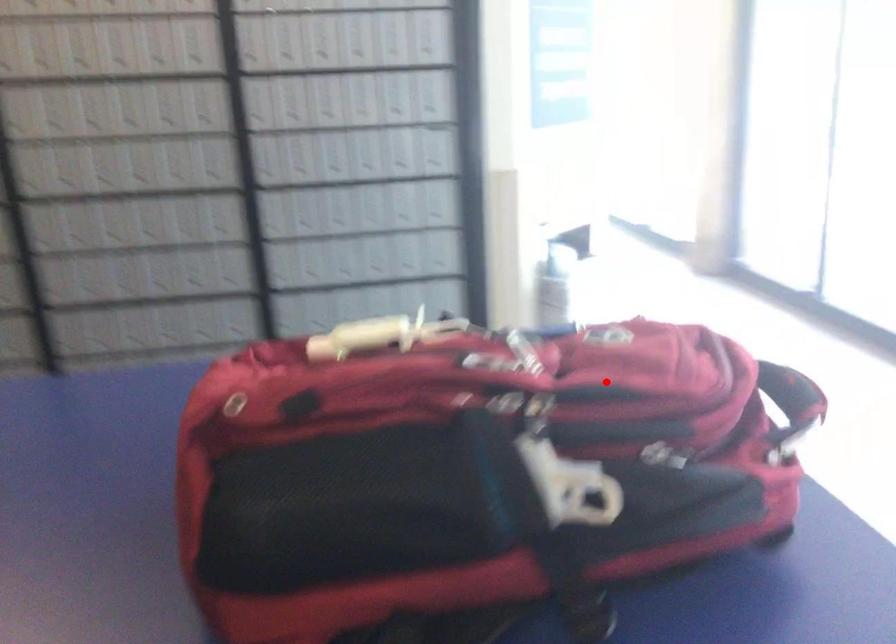
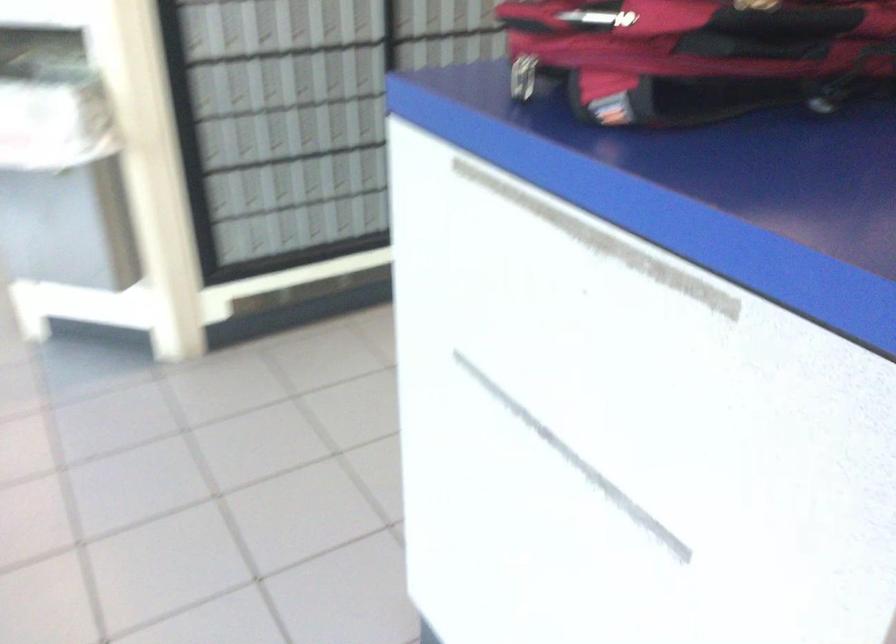
Question: I am providing you with two images of the same scene from different viewpoints. Given a red point in image1, look at the same physical point in image2. Is it:

Choices:
 (A) Closer to the viewpoint
 (B) Farther from the viewpoint

Answer: (B)